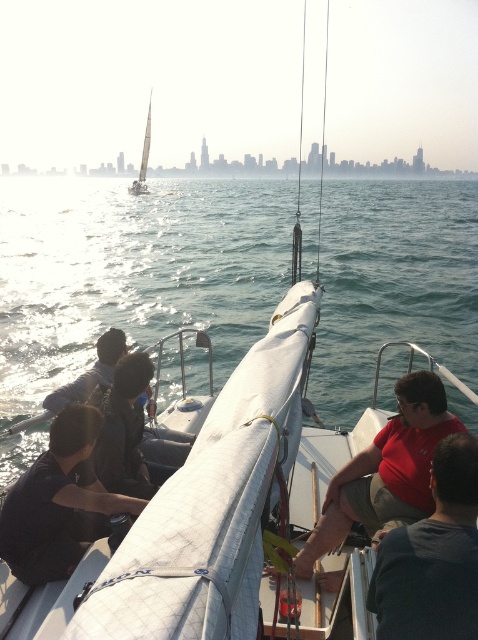
Question: Which object is positioned farthest from the white sailboat at upper left?

Choices:
 (A) red matte shirt at center
 (B) red cotton shirt at center
 (C) dark brown leather jacket at center

Answer: (B)

Question: Is blue water at center in front of dark brown leather jacket at lower left?

Choices:
 (A) no
 (B) yes

Answer: (A)

Question: Estimate the real-world distances between objects in this image. Which object is closer to the blue water at center?

Choices:
 (A) dark blue shirt at lower left
 (B) dark brown leather jacket at lower left

Answer: (A)

Question: Which point is farther to the camera?

Choices:
 (A) red cotton shirt at center
 (B) dark brown leather jacket at lower left

Answer: (B)

Question: Does blue water at center lie in front of dark brown leather jacket at center?

Choices:
 (A) yes
 (B) no

Answer: (B)

Question: Can you confirm if red matte shirt at center is positioned to the left of dark brown leather jacket at lower left?

Choices:
 (A) no
 (B) yes

Answer: (A)